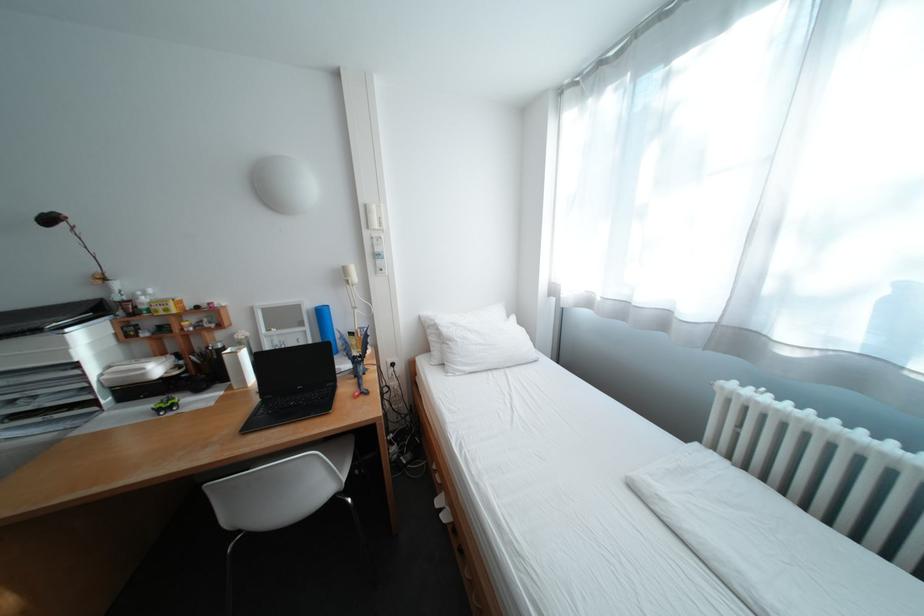
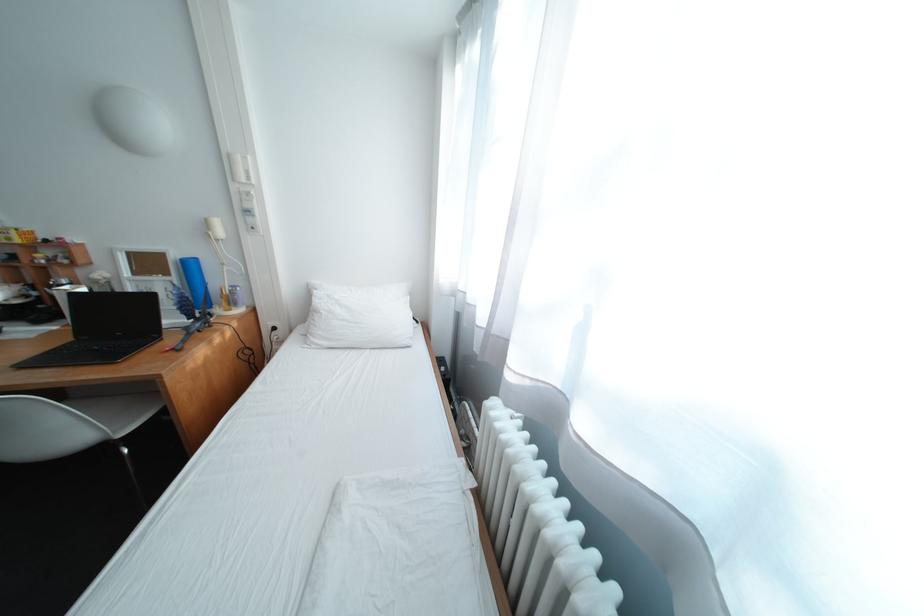
Question: Based on the continuous images, in which direction is the camera rotating? Reply with the corresponding letter.

Choices:
 (A) Left
 (B) Right
 (C) Up
 (D) Down

Answer: (D)